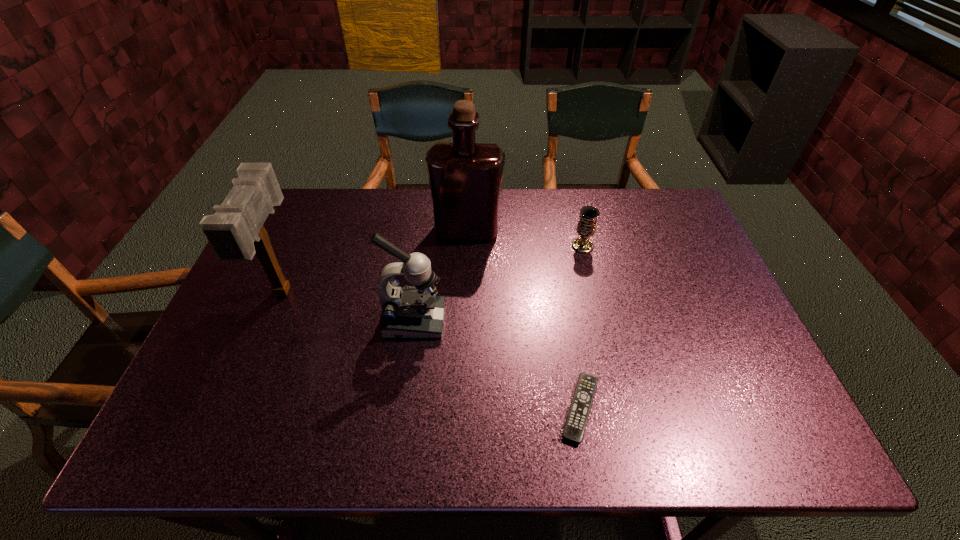
Where is `the tallest object`? the tallest object is located at coordinates (465, 177).

You are a GUI agent. You are given a task and a screenshot of the screen. Output one action in this format:
    pyautogui.click(x=<x>, y=<y>)
    Task: Click on the leftmost object
    Image resolution: width=960 pixels, height=540 pixels.
    Given the screenshot: What is the action you would take?
    pyautogui.click(x=236, y=233)

The height and width of the screenshot is (540, 960). I want to click on microscope, so click(x=415, y=311).

In order to click on chalice in this screenshot , I will do `click(586, 227)`.

Find the location of a particular element. This screenshot has height=540, width=960. the second shortest object is located at coordinates (586, 227).

Where is `the shortest object`? This screenshot has height=540, width=960. the shortest object is located at coordinates (575, 425).

Find the location of a particular element. the fourth object from left to right is located at coordinates (575, 425).

Where is `free location located on the front of the liquor`? This screenshot has height=540, width=960. free location located on the front of the liquor is located at coordinates (467, 262).

Find the location of a particular element. The image size is (960, 540). blank area located on the front of the mallet is located at coordinates (253, 363).

The width and height of the screenshot is (960, 540). I want to click on vacant region located on the left of the microscope, so click(238, 321).